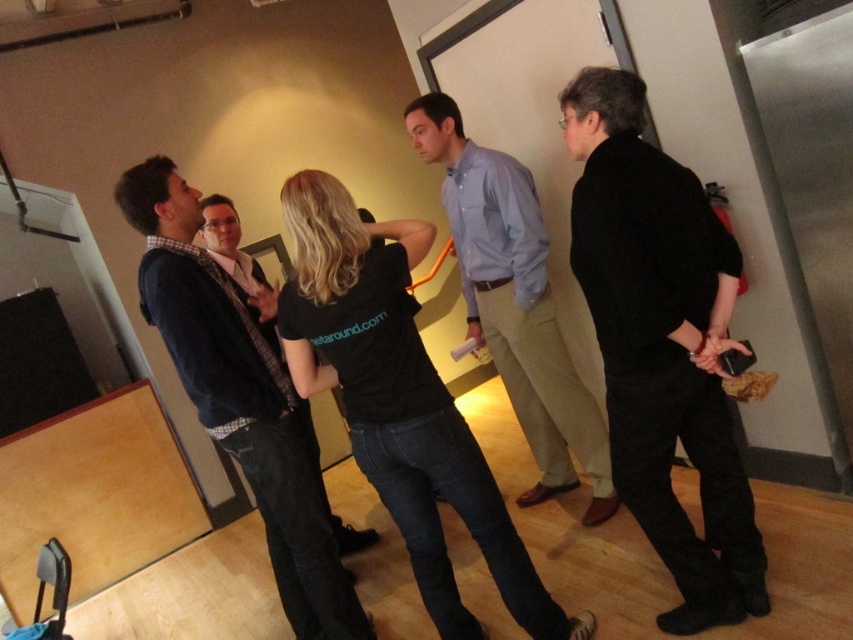
Question: Is black cotton t-shirt at center bigger than light blue shirt at center?

Choices:
 (A) no
 (B) yes

Answer: (A)

Question: Can you confirm if dark blue sweater at center is thinner than light blue shirt at center?

Choices:
 (A) yes
 (B) no

Answer: (A)

Question: Which object appears closest to the camera in this image?

Choices:
 (A) black matte pants at right
 (B) light blue shirt at center
 (C) dark blue sweater at center

Answer: (A)

Question: Estimate the real-world distances between objects in this image. Which object is closer to the dark blue sweater at center?

Choices:
 (A) light blue shirt at center
 (B) black cotton t-shirt at center
 (C) black matte pants at right

Answer: (B)

Question: Which point is closer to the camera?

Choices:
 (A) (196, 275)
 (B) (508, 538)
 (C) (672, 440)
 (D) (541, 316)

Answer: (C)

Question: From the image, what is the correct spatial relationship of dark blue sweater at center in relation to light blue shirt at center?

Choices:
 (A) left
 (B) right

Answer: (A)